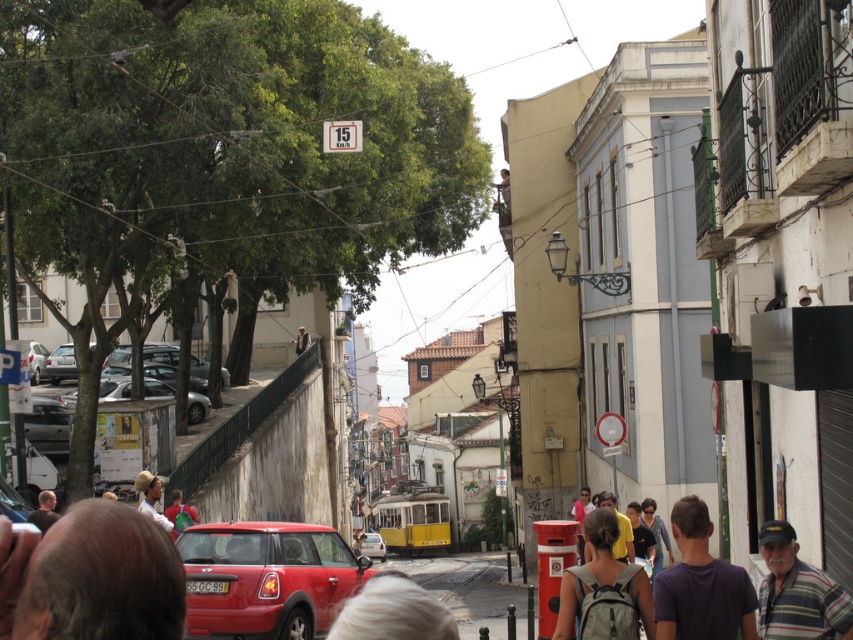
Measure the distance from matte silver car at center to metallic red car at center.

matte silver car at center is 30.27 meters from metallic red car at center.

Image resolution: width=853 pixels, height=640 pixels. Identify the location of matte silver car at center. (114, 388).

Does purple cotton t-shirt at center have a lesser width compared to metallic red car at center?

Incorrect, purple cotton t-shirt at center's width is not less than metallic red car at center's.

This screenshot has width=853, height=640. Describe the element at coordinates (700, 584) in the screenshot. I see `purple cotton t-shirt at center` at that location.

Find the location of a particular element. The width and height of the screenshot is (853, 640). purple cotton t-shirt at center is located at coordinates (700, 584).

At what (x,y) coordinates should I click in order to perform the action: click on dark brown hair at lower left. Please return your answer as a coordinate pair (x, y). This screenshot has width=853, height=640. Looking at the image, I should click on (91, 577).

Does dark brown hair at lower left appear over metallic red car at center?

Yes, dark brown hair at lower left is above metallic red car at center.

Does point (152, 618) come closer to viewer compared to point (370, 550)?

Yes.

This screenshot has height=640, width=853. What are the coordinates of `dark brown hair at lower left` in the screenshot? It's located at (91, 577).